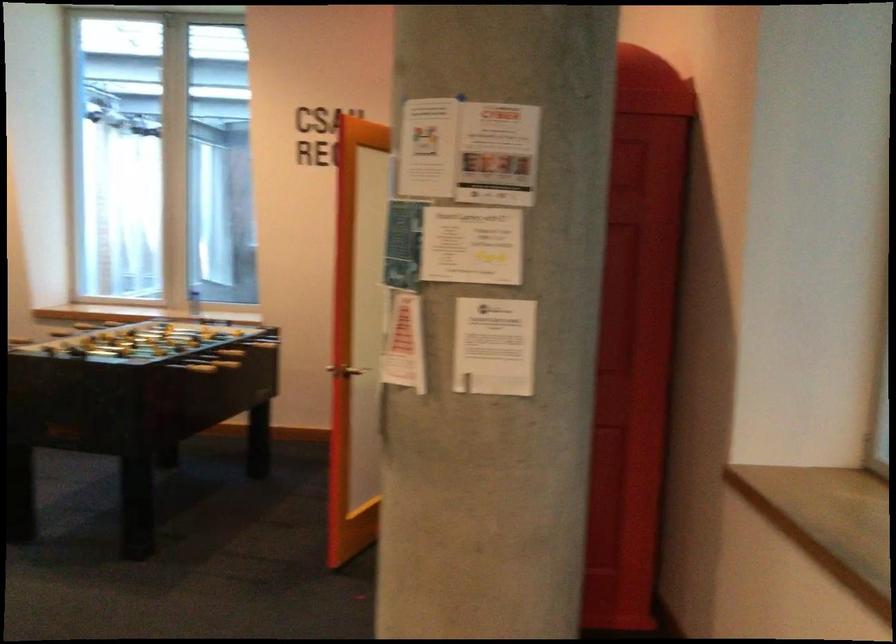
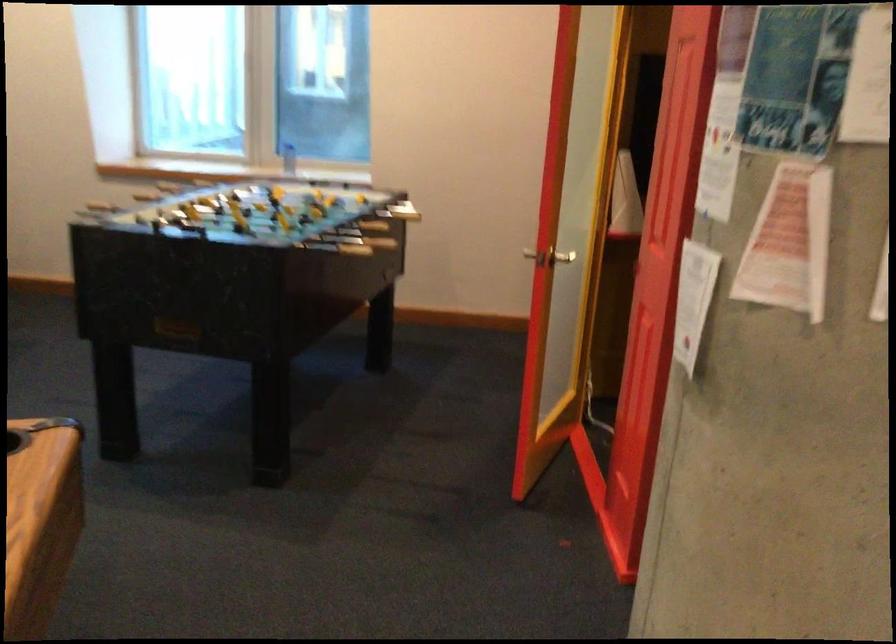
The images are taken continuously from a first-person perspective. In which direction are you moving?

The cameraman walked toward left, forward.